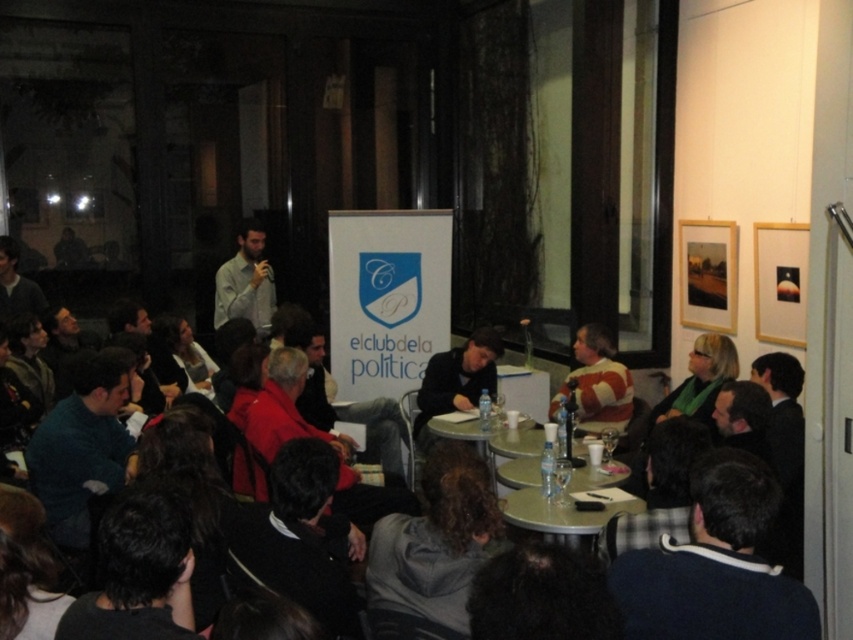
Who is higher up, dark blue sweater at center or green plastic table at center?

dark blue sweater at center is higher up.

Does point (486, 352) come farther from viewer compared to point (520, 490)?

Yes.

You are a GUI agent. You are given a task and a screenshot of the screen. Output one action in this format:
    pyautogui.click(x=<x>, y=<y>)
    Task: Click on the dark blue sweater at center
    This screenshot has height=640, width=853.
    Given the screenshot: What is the action you would take?
    pyautogui.click(x=456, y=380)

Which is more to the left, matte black laptop at center or green plastic table at center?

green plastic table at center is more to the left.

Does matte black laptop at center appear over green plastic table at center?

Correct, matte black laptop at center is located above green plastic table at center.

Find the location of `matte black laptop at center`. matte black laptop at center is located at coordinates (804, 614).

Looking at this image, which is more to the left, matte gray shirt at center or green plastic table at center?

Positioned to the left is matte gray shirt at center.

Between point (259, 262) and point (524, 506), which one is positioned in front?

Point (524, 506)

What do you see at coordinates (245, 282) in the screenshot? This screenshot has height=640, width=853. I see `matte gray shirt at center` at bounding box center [245, 282].

Identify the location of matte gray shirt at center. (245, 282).